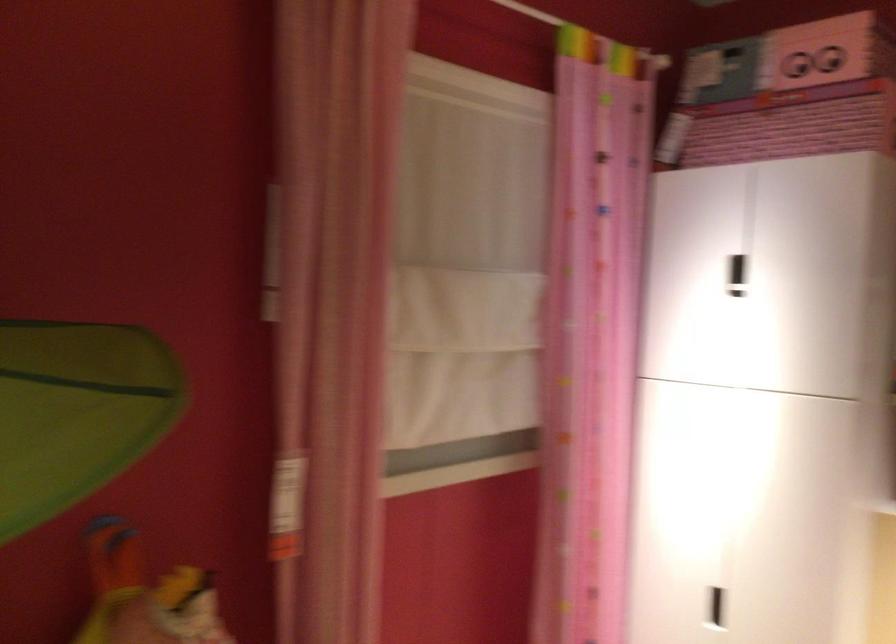
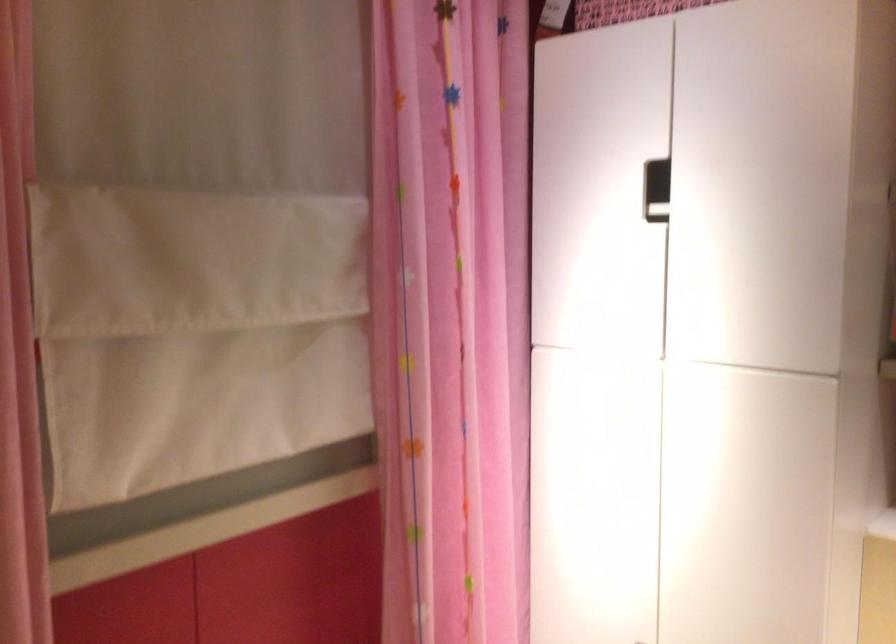
Question: The first image is from the beginning of the video and the second image is from the end. How did the camera likely rotate when shooting the video?

Choices:
 (A) Left
 (B) Right
 (C) Up
 (D) Down

Answer: (D)